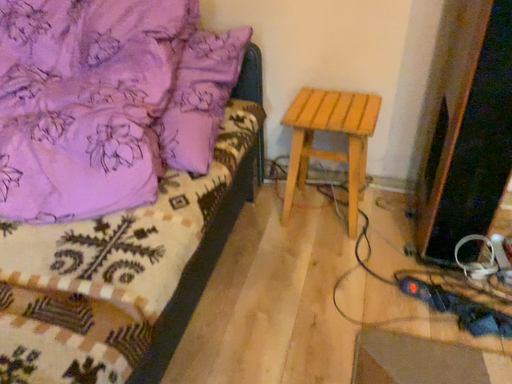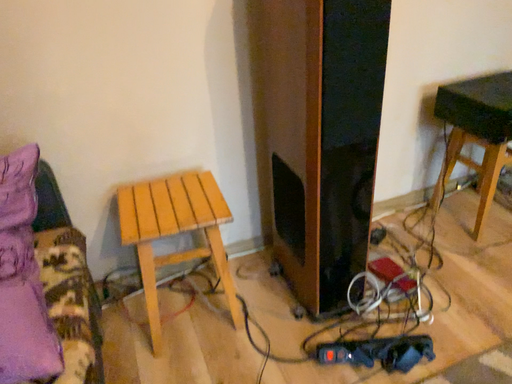
Question: Which way did the camera rotate in the video?

Choices:
 (A) rotated upward
 (B) rotated downward

Answer: (A)